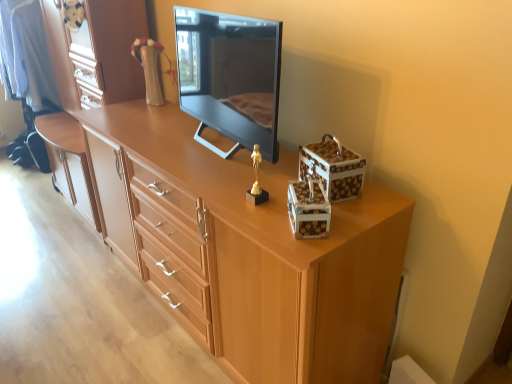
Find the location of a particular element. The width and height of the screenshot is (512, 384). vacant space to the left of light wood chest of drawers at center is located at coordinates (75, 301).